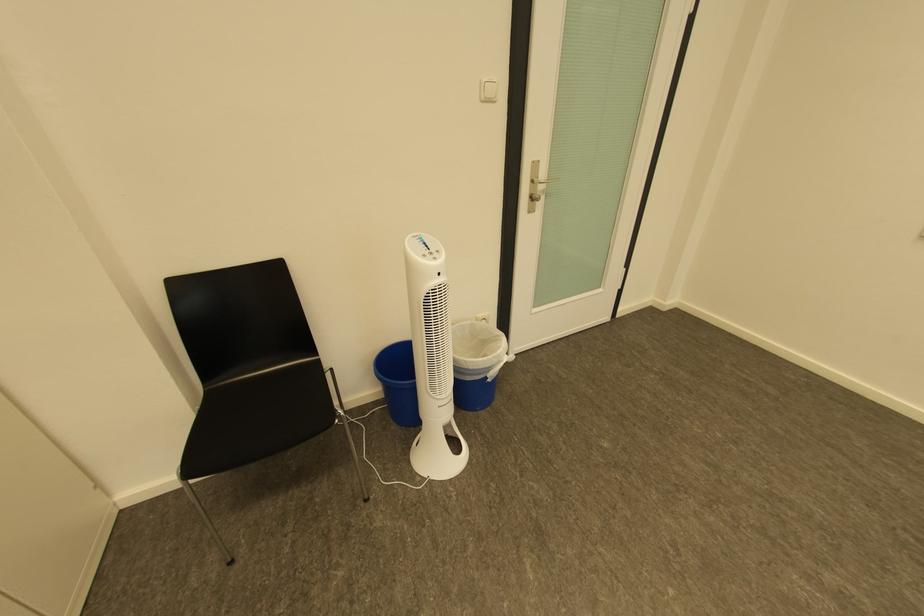
Where would you pull the door handle? Please return your answer as a coordinate pair (x, y).

(536, 185)